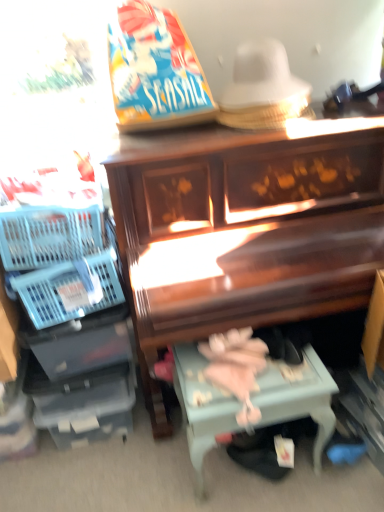
Question: Do you think blue plastic basket at left is within wooden piano at center, or outside of it?

Choices:
 (A) inside
 (B) outside

Answer: (B)

Question: Based on their sizes in the image, would you say blue plastic basket at left is bigger or smaller than wooden piano at center?

Choices:
 (A) big
 (B) small

Answer: (B)

Question: Which is nearer to the wooden piano at center?

Choices:
 (A) light blue painted wood table at lower center
 (B) blue plastic basket at left

Answer: (A)

Question: Which is nearer to the light blue painted wood table at lower center?

Choices:
 (A) blue plastic basket at left
 (B) wooden piano at center

Answer: (B)